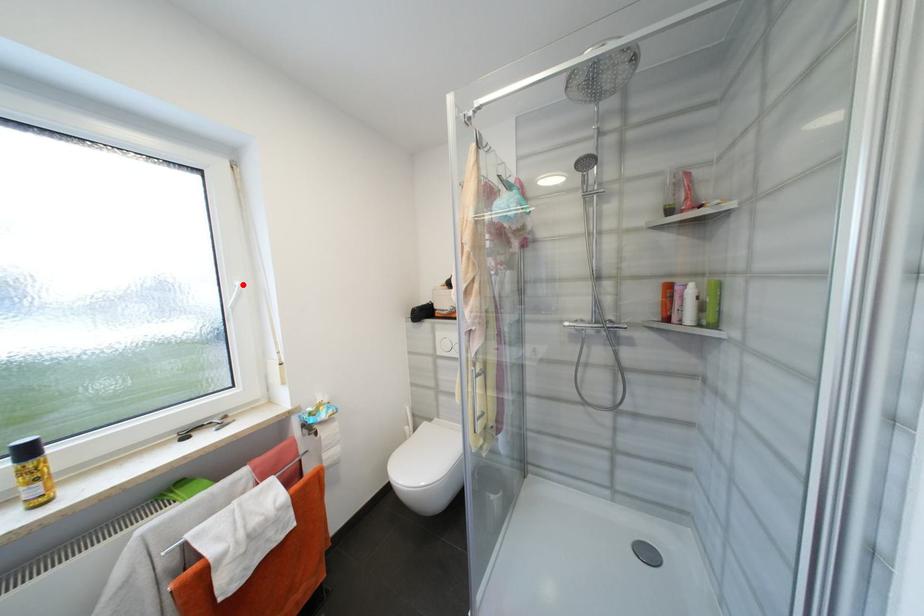
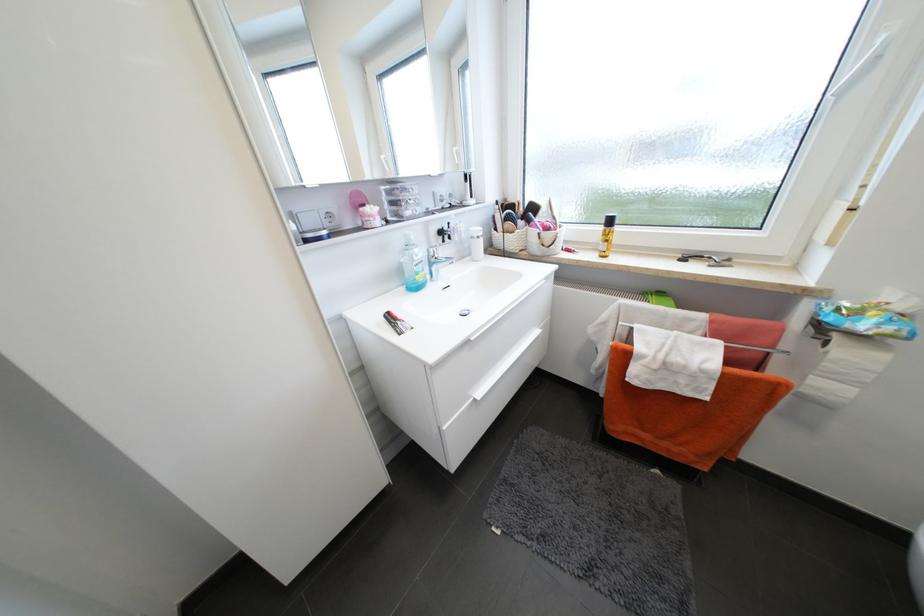
Where in the second image is the point corresponding to the highlighted location from the first image?

(888, 41)